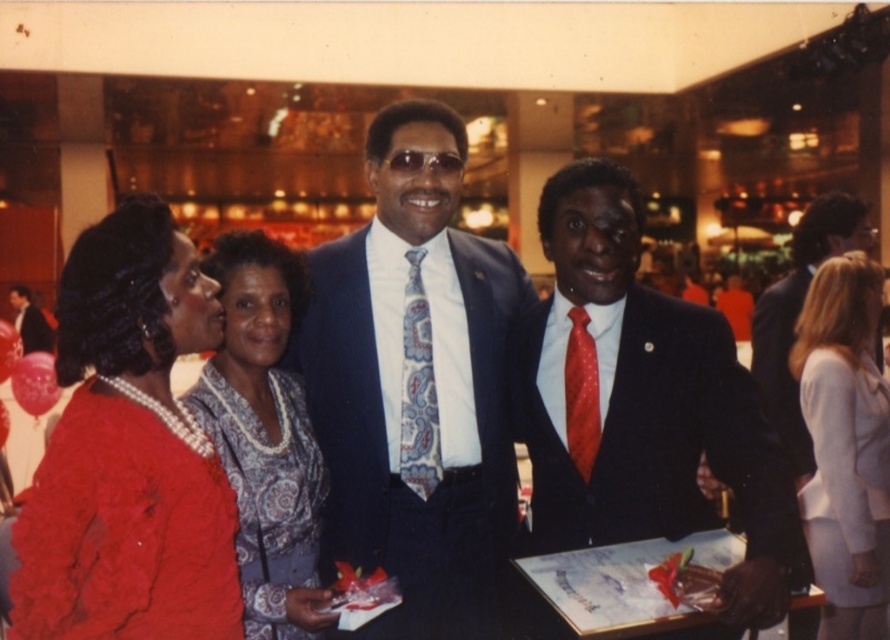
Question: Is blue satin suit at center thinner than matte red coat at left?

Choices:
 (A) no
 (B) yes

Answer: (A)

Question: Among these objects, which one is nearest to the camera?

Choices:
 (A) shiny black suit at center
 (B) matte black suit at right
 (C) white satin dress at lower right
 (D) matte red coat at left

Answer: (D)

Question: Estimate the real-world distances between objects in this image. Which object is closer to the patterned fabric dress at center?

Choices:
 (A) matte red coat at left
 (B) red dotted tie at right
 (C) matte black suit at right

Answer: (A)

Question: Can you confirm if matte red coat at left is positioned below white satin dress at lower right?

Choices:
 (A) yes
 (B) no

Answer: (B)

Question: Does shiny black suit at center have a lesser width compared to matte red coat at left?

Choices:
 (A) no
 (B) yes

Answer: (A)

Question: Which point is farther from the camera taking this photo?

Choices:
 (A) (595, 358)
 (B) (232, 301)

Answer: (B)